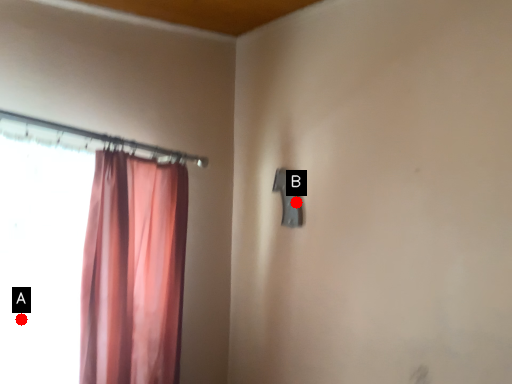
Question: Two points are circled on the image, labeled by A and B beside each circle. Which point is further to the camera?

Choices:
 (A) A is further
 (B) B is further

Answer: (B)